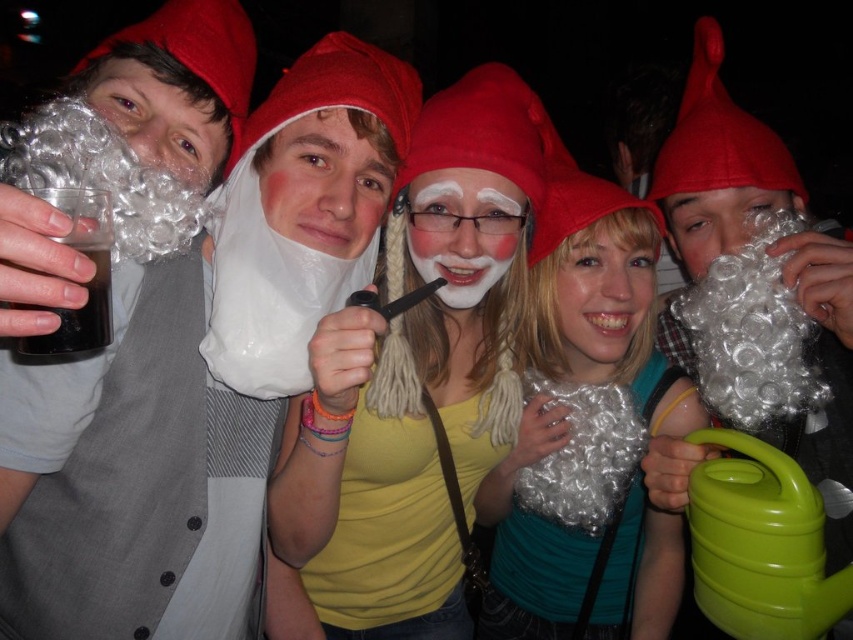
You are at a costume party and see two items at the center of the scene. Which one is positioned to the right? The items are the white fluffy wig at center and the white plastic bag at center.

The white fluffy wig at center is positioned to the right of the white plastic bag at center.

You are a photographer at the event and want to capture the white fluffy wig at center and the white plastic bag at center in a single photo. Which object should you focus on first to ensure both are in frame?

The white fluffy wig at center is below the white plastic bag at center, so you should focus on the white plastic bag at center first to ensure both are in frame.

You are organizing a costume party and need to decide which item can fit into a storage box that is 15 cm wide. Based on the image, which item between the white fluffy wig at center and the white plastic bag at center is narrower?

The white fluffy wig at center is narrower than the white plastic bag at center, so it can fit into the 15 cm wide storage box.